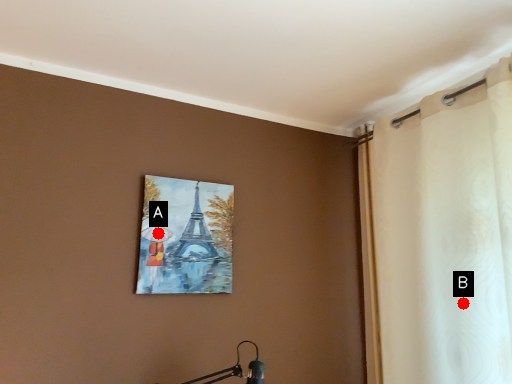
Question: Two points are circled on the image, labeled by A and B beside each circle. Which point appears farthest from the camera in this image?

Choices:
 (A) A is further
 (B) B is further

Answer: (A)